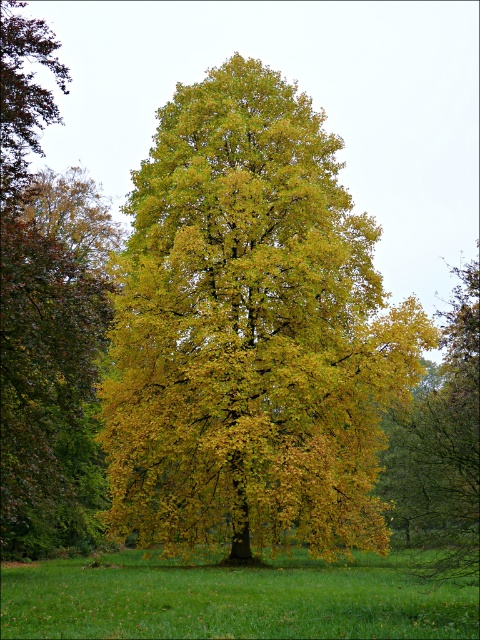
Between yellow-green leafy tree at center and green grassy field at center, which one has less height?

With less height is green grassy field at center.

Image resolution: width=480 pixels, height=640 pixels. What are the coordinates of `yellow-green leafy tree at center` in the screenshot? It's located at (251, 333).

Is yellow-green leaves at center above green grassy field at center?

Yes, yellow-green leaves at center is above green grassy field at center.

Does yellow-green leaves at center have a smaller size compared to green grassy field at center?

No.

Where is `yellow-green leaves at center`? This screenshot has width=480, height=640. yellow-green leaves at center is located at coordinates (47, 314).

Between yellow-green leafy tree at center and yellow-green leaves at center, which one has more height?

yellow-green leaves at center

Who is more forward, (152, 292) or (38, 429)?

Point (38, 429)

The height and width of the screenshot is (640, 480). I want to click on yellow-green leafy tree at center, so click(251, 333).